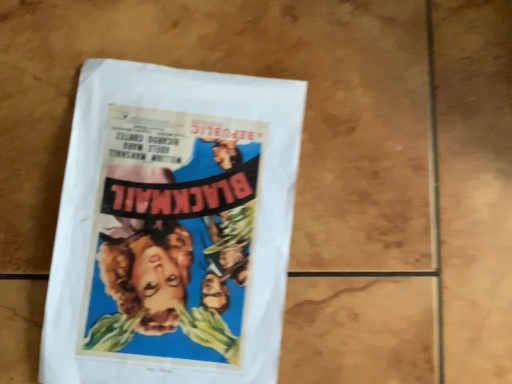
Find the location of a particular element. Image resolution: width=512 pixels, height=384 pixels. free space above matte paper poster at center (from a real-world perspective) is located at coordinates (178, 213).